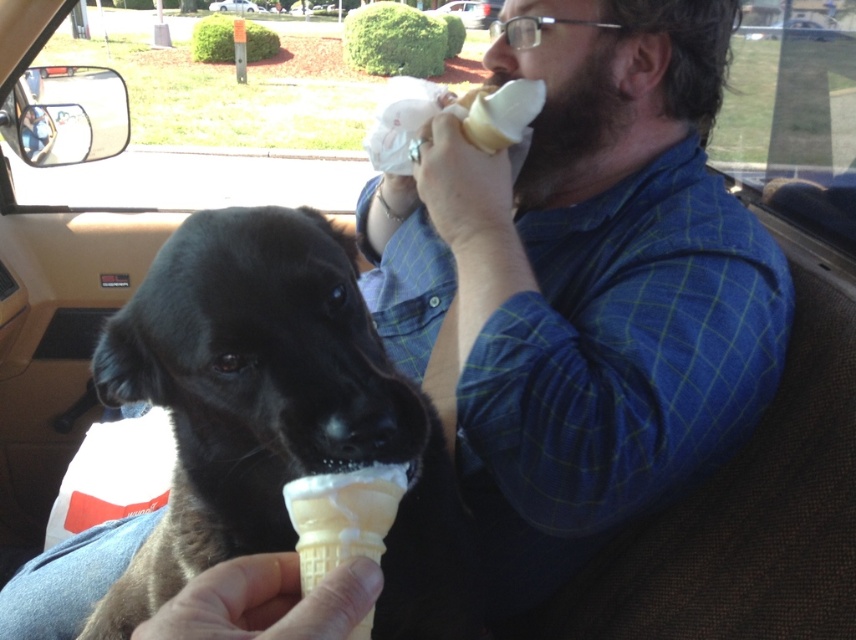
You are a passenger in the car and want to grab the vanilla waffle cone at center and the white plastic bag at center. Which item will you reach first if you extend your hand forward?

The vanilla waffle cone at center is closer to the viewer than the white plastic bag at center, so you will reach the vanilla waffle cone at center first.